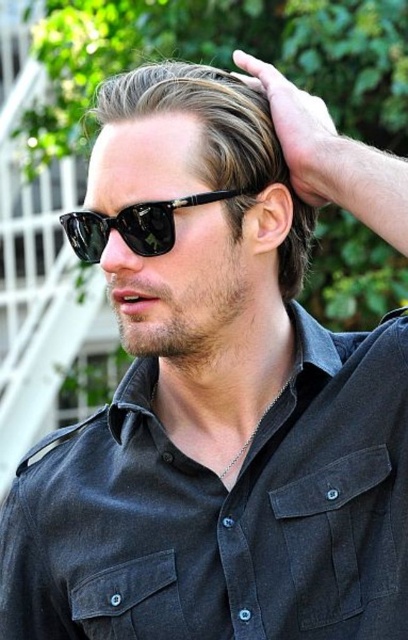
Between point (130, 81) and point (281, 96), which one is positioned in front?

Point (130, 81)

Does black shiny sunglasses at center have a greater width compared to black leather hand at upper center?

Indeed, black shiny sunglasses at center has a greater width compared to black leather hand at upper center.

Does point (310, 230) lie in front of point (336, 140)?

No, (310, 230) is further to viewer.

In order to click on black shiny sunglasses at center in this screenshot , I will do `click(199, 164)`.

Does point (237, 65) come behind point (130, 228)?

Yes, it is behind point (130, 228).

Does black leather hand at upper center appear on the right side of black shiny sunglasses at upper center?

Indeed, black leather hand at upper center is positioned on the right side of black shiny sunglasses at upper center.

Is point (274, 97) behind point (257, 189)?

That is True.

Identify the location of black leather hand at upper center. This screenshot has height=640, width=408. (301, 134).

Between black shiny sunglasses at center and black shiny sunglasses at upper center, which one has more height?

Standing taller between the two is black shiny sunglasses at center.

Can you confirm if black shiny sunglasses at center is positioned above black shiny sunglasses at upper center?

Yes, black shiny sunglasses at center is above black shiny sunglasses at upper center.

This screenshot has width=408, height=640. I want to click on black shiny sunglasses at center, so click(199, 164).